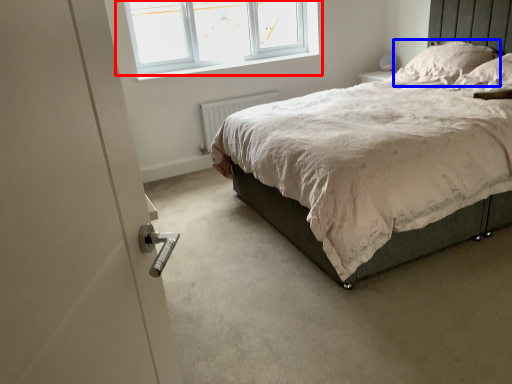
Question: Which object is further to the camera taking this photo, window (highlighted by a red box) or pillow (highlighted by a blue box)?

Choices:
 (A) window
 (B) pillow

Answer: (A)